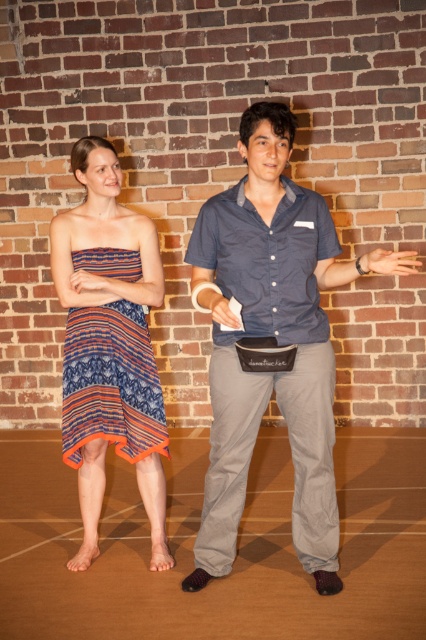
Between matte blue shirt at center and textured cotton dress at center, which one has less height?

With less height is textured cotton dress at center.

Measure the distance between matte blue shirt at center and camera.

matte blue shirt at center and camera are 8.76 feet apart.

Locate an element on the screen. The width and height of the screenshot is (426, 640). matte blue shirt at center is located at coordinates (273, 340).

Is matte blue shirt at center to the right of striped fabric dress at center from the viewer's perspective?

Yes, matte blue shirt at center is to the right of striped fabric dress at center.

Who is shorter, matte blue shirt at center or striped fabric dress at center?

With less height is striped fabric dress at center.

At what (x,y) coordinates should I click in order to perform the action: click on matte blue shirt at center. Please return your answer as a coordinate pair (x, y). Looking at the image, I should click on 273,340.

The height and width of the screenshot is (640, 426). I want to click on matte blue shirt at center, so click(273, 340).

Between point (131, 294) and point (109, 429), which one is positioned in front?

Positioned in front is point (131, 294).

Does striped fabric dress at center have a smaller size compared to textured cotton dress at center?

No, striped fabric dress at center is not smaller than textured cotton dress at center.

Does point (155, 536) come farther from viewer compared to point (146, 404)?

Yes, point (155, 536) is behind point (146, 404).

Identify the location of striped fabric dress at center. click(x=109, y=344).